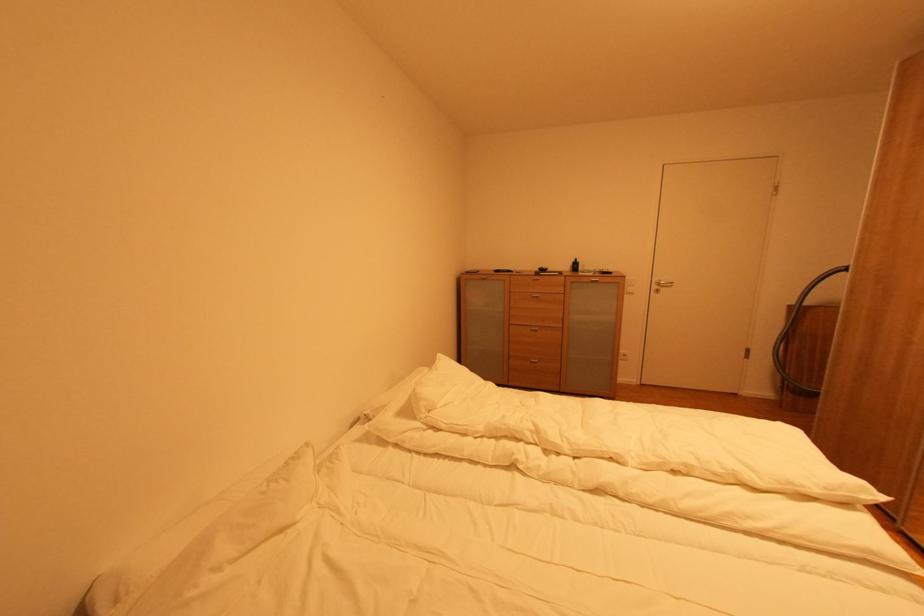
Which object does [575,265] point to?

It corresponds to the black bottle in the image.